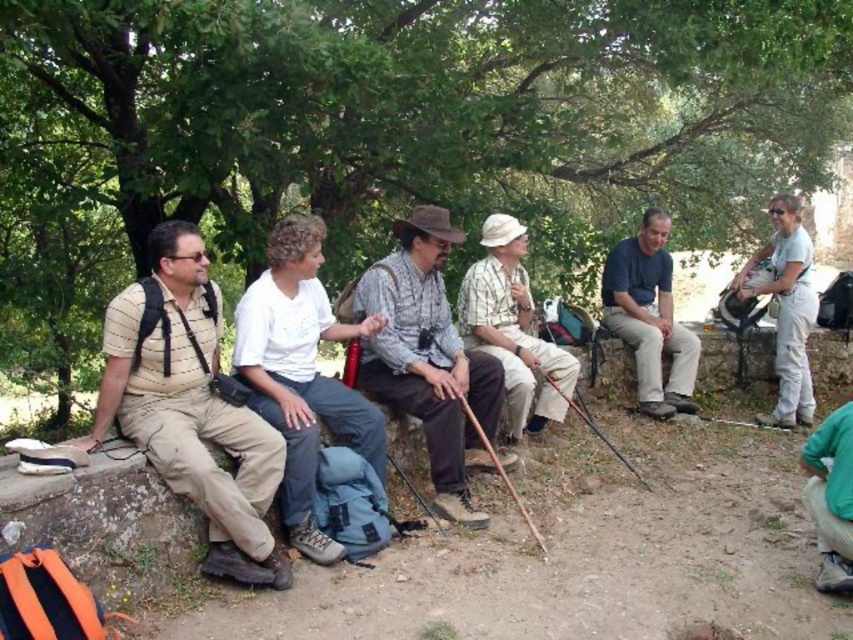
You are a photographer trying to capture a photo of the plaid cotton shirt at center and the white cotton shirt at upper right. Which shirt should you focus on first if you want to ensure both are in focus without moving the camera? Explain your reasoning based on their positions.

The plaid cotton shirt at center is below the white cotton shirt at upper right. To ensure both are in focus without moving the camera, focus on the plaid cotton shirt at center first since it is closer to the camera. This way, the depth of field will extend backward to include the white cotton shirt at upper right.

You are part of this hiking group and want to take a photo of the dark blue shirt at center and the green fabric pants at lower right. Which object should be positioned closer to the camera to ensure both are in focus?

The green fabric pants at lower right is behind the dark blue shirt at center, so positioning the dark blue shirt at center closer to the camera will keep both in focus as they are on the same focal plane.